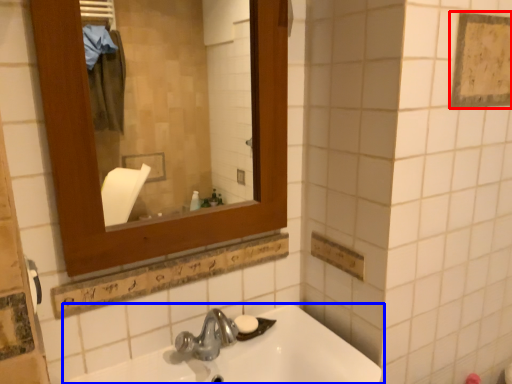
Question: Which object is closer to the camera taking this photo, square (highlighted by a red box) or sink (highlighted by a blue box)?

Choices:
 (A) square
 (B) sink

Answer: (B)